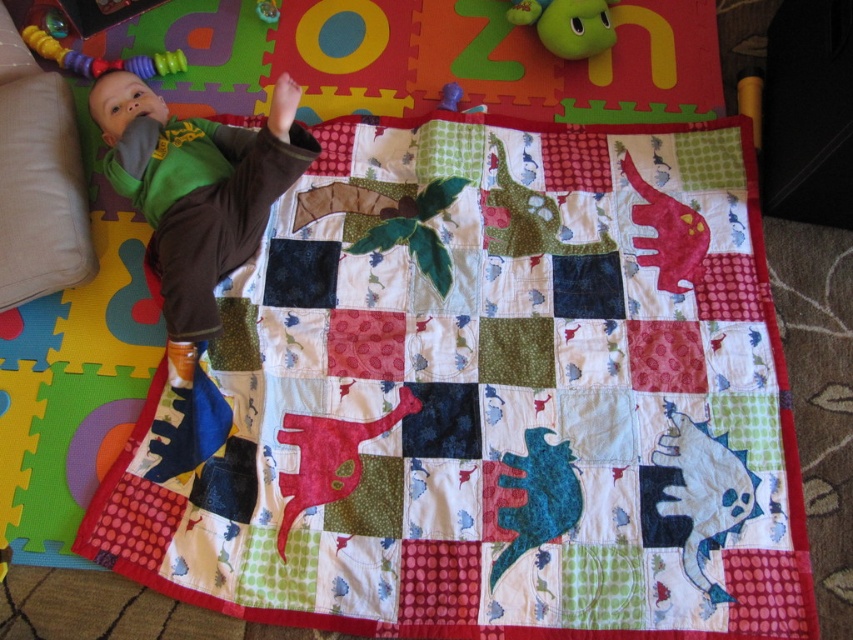
Based on the coordinates provided, which object corresponds to the point at (196, 193)?

The point at (196, 193) corresponds to the matte green shirt at upper left.

You are a parent trying to place a toy for your baby. The baby is lying on the play mat and blanket. You have the matte red dinosaur at center and the rubberized plastic teething ring at upper left. If you want to place both toys within 70 centimeters of each other, will they fit within the required distance?

→ The matte red dinosaur at center and the rubberized plastic teething ring at upper left are 68.74 centimeters apart, so yes, they are within the 70 centimeter requirement.

You are a photographer setting up a shoot for a baby product catalog. You need to place a small sticker on the object that is smaller between the matte green shirt at upper left and the rubberized plastic teething ring at upper left. Which object should you place the sticker on?

The rubberized plastic teething ring at upper left is the smaller object between the two, so you should place the sticker on the rubberized plastic teething ring at upper left.